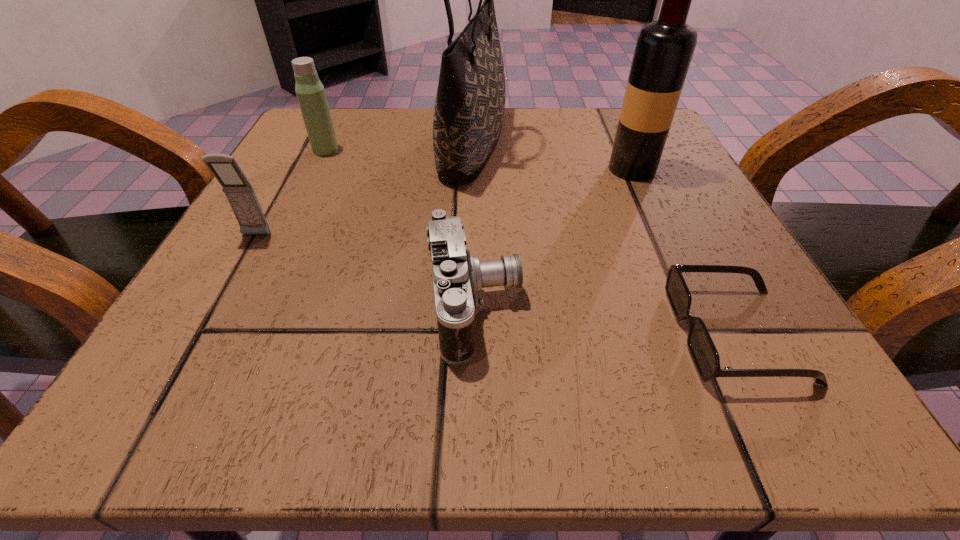
Where is `free space at the right edge of the desktop`? Image resolution: width=960 pixels, height=540 pixels. free space at the right edge of the desktop is located at coordinates (655, 254).

The height and width of the screenshot is (540, 960). Find the location of `vacant space at the far left corner of the desktop`. vacant space at the far left corner of the desktop is located at coordinates (277, 156).

The image size is (960, 540). I want to click on unoccupied area between the tote bag and the fourth farthest object, so click(365, 190).

Identify the location of free spot between the fifth tallest object and the wine bottle. The image size is (960, 540). (553, 238).

Identify the location of free space between the tote bag and the shortest object. The image size is (960, 540). (604, 239).

You are a GUI agent. You are given a task and a screenshot of the screen. Output one action in this format:
    pyautogui.click(x=<x>, y=<y>)
    Task: Click on the free space that is in between the shortest object and the camera
    
    Given the screenshot: What is the action you would take?
    pyautogui.click(x=605, y=321)

The width and height of the screenshot is (960, 540). Find the location of `unoccupied position between the shortest object and the wine bottle`. unoccupied position between the shortest object and the wine bottle is located at coordinates (684, 252).

This screenshot has height=540, width=960. In order to click on empty location between the thermos bottle and the fifth tallest object in this screenshot , I will do `click(400, 228)`.

Identify the location of vacant area between the second shortest object and the tote bag. (474, 225).

Find the location of a particular element. The width and height of the screenshot is (960, 540). free point between the cellular telephone and the wine bottle is located at coordinates (444, 202).